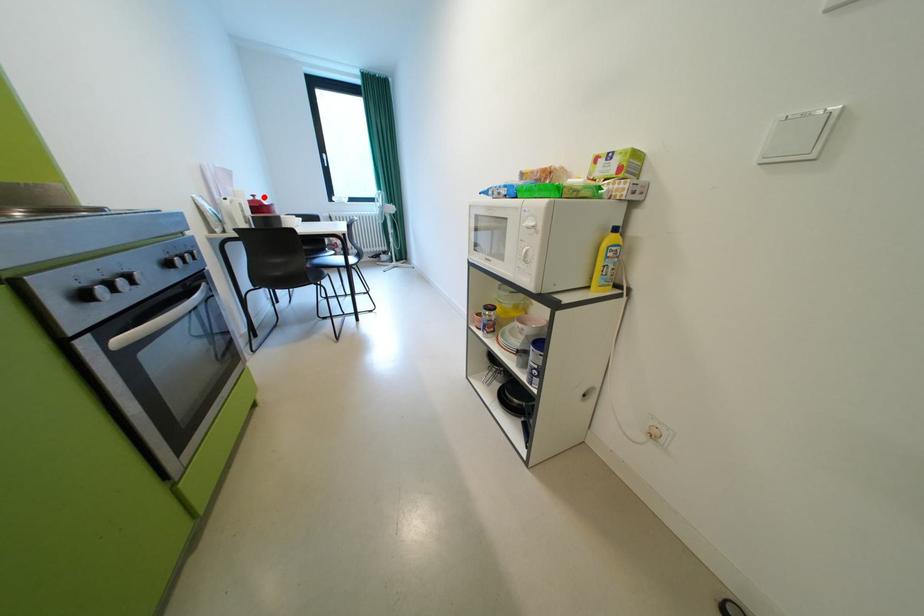
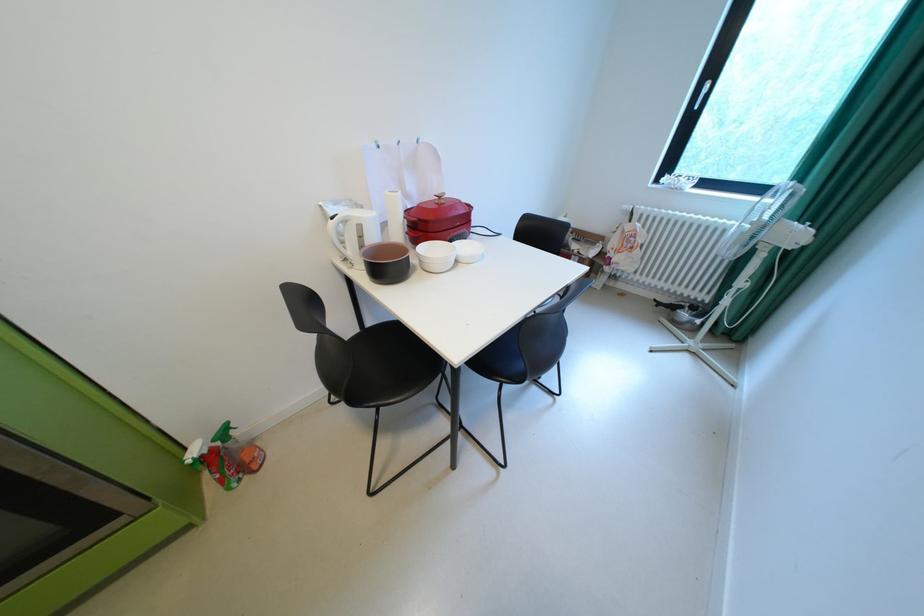
Where in the second image is the point corresponding to the highlighted location from the first image?

(450, 198)